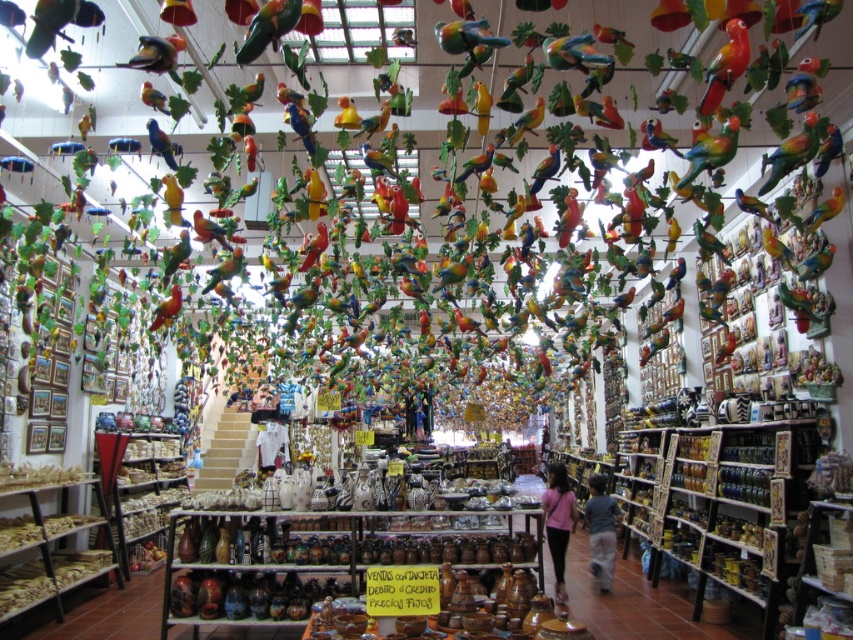
Measure the distance between shiny multicolored parrot at upper right and matte blue parrot at upper center.

shiny multicolored parrot at upper right is 3.06 meters from matte blue parrot at upper center.

Is shiny multicolored parrot at upper right thinner than matte blue parrot at upper center?

Indeed, shiny multicolored parrot at upper right has a lesser width compared to matte blue parrot at upper center.

Is point (715, 84) behind point (170, 161)?

No.

Identify the location of shiny multicolored parrot at upper right. (724, 67).